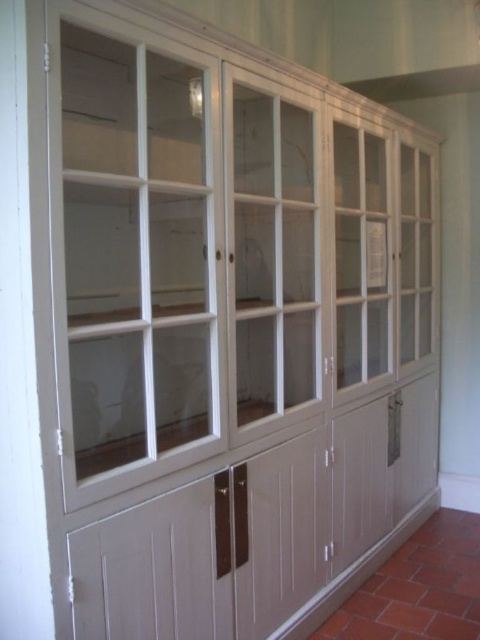
Between clear glass cabinet at left and clear glass cabinet at center, which one appears on the right side from the viewer's perspective?

From the viewer's perspective, clear glass cabinet at center appears more on the right side.

Who is higher up, clear glass cabinet at left or clear glass cabinet at center?

clear glass cabinet at center

Between point (72, 124) and point (235, 237), which one is positioned behind?

Positioned behind is point (235, 237).

Locate an element on the screen. clear glass cabinet at left is located at coordinates (132, 252).